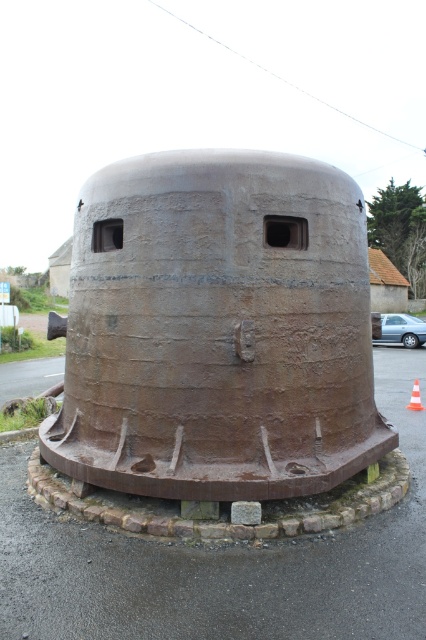
Between rusty metal water tower at center and orange/reflective traffic cone at center, which one is positioned higher?

rusty metal water tower at center

Between point (305, 346) and point (423, 404), which one is positioned in front?

Point (305, 346) is more forward.

At what (x,y) coordinates should I click in order to perform the action: click on rusty metal water tower at center. Please return your answer as a coordinate pair (x, y). Looking at the image, I should click on (218, 330).

Is rusty metal water tower at center above silver metallic car at center?

Yes, rusty metal water tower at center is above silver metallic car at center.

Is point (232, 237) closer to camera compared to point (425, 324)?

Yes, point (232, 237) is in front of point (425, 324).

Between point (157, 157) and point (420, 339), which one is positioned behind?

Point (420, 339)

You are a GUI agent. You are given a task and a screenshot of the screen. Output one action in this format:
    pyautogui.click(x=<x>, y=<y>)
    Task: Click on the rusty metal water tower at center
    The height and width of the screenshot is (640, 426).
    Given the screenshot: What is the action you would take?
    pos(218,330)

Consider the image. Who is positioned more to the right, silver metallic car at center or orange/reflective traffic cone at center?

Positioned to the right is silver metallic car at center.

This screenshot has height=640, width=426. Identify the location of silver metallic car at center. (402, 330).